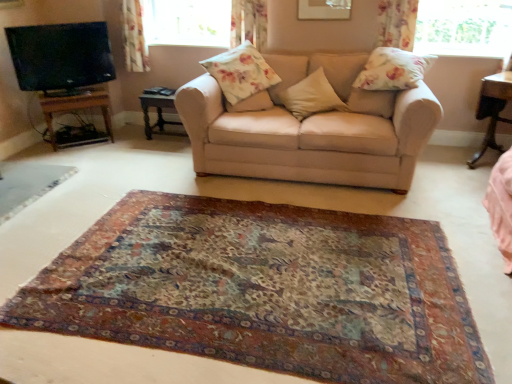
Find the location of `free space in front of wooden table at left, the third table in the right-to-left sequence`. free space in front of wooden table at left, the third table in the right-to-left sequence is located at coordinates (64, 155).